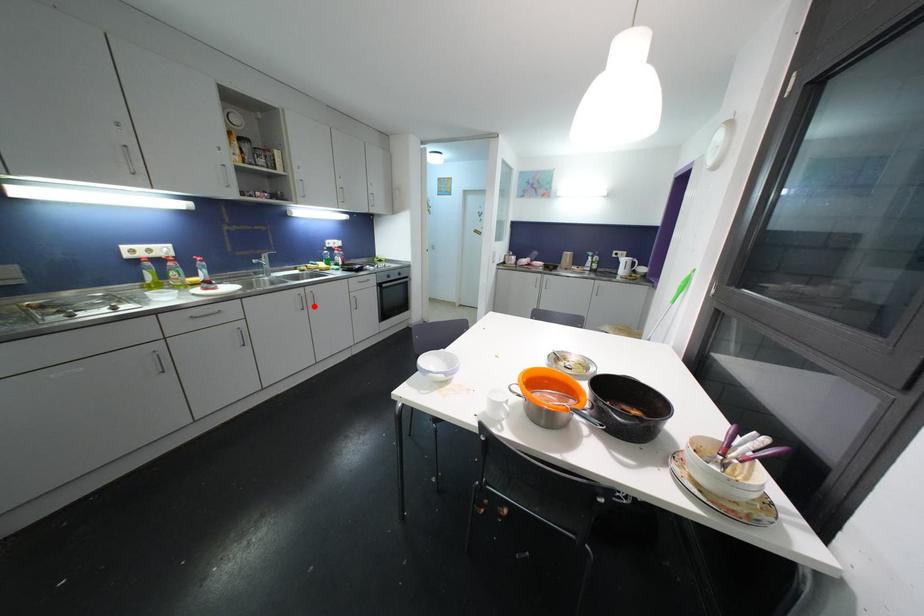
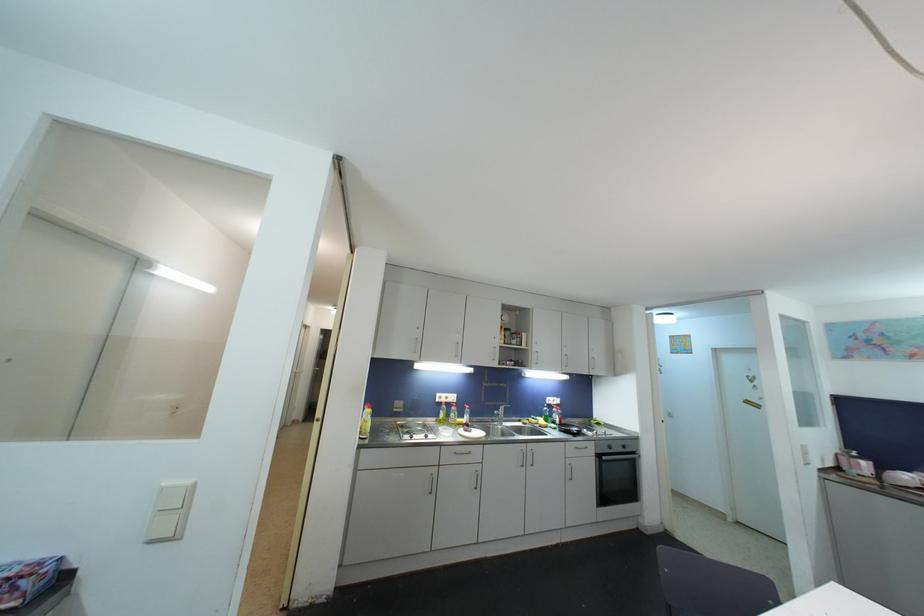
Question: I am providing you with two images of the same scene from different viewpoints. A red point is shown in image1. For the corresponding object point in image2, is it positioned nearer or farther from the camera?

Choices:
 (A) Nearer
 (B) Farther

Answer: (B)